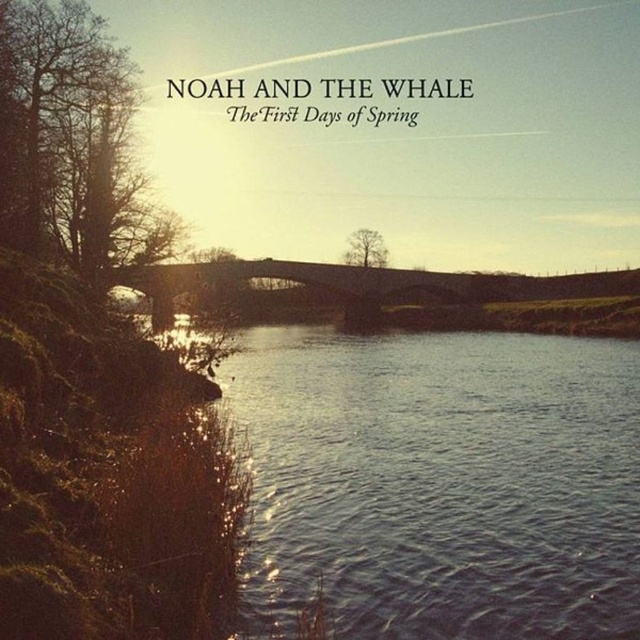
Question: Which object is closer to the camera taking this photo?

Choices:
 (A) bare wood tree at left
 (B) bare wood tree at center

Answer: (A)

Question: Estimate the real-world distances between objects in this image. Which object is farther from the bare wood tree at center?

Choices:
 (A) bare wood tree at left
 (B) blue water at center

Answer: (B)

Question: Does blue water at center have a greater width compared to bare wood tree at left?

Choices:
 (A) no
 (B) yes

Answer: (B)

Question: Is bare wood tree at left wider than bare wood tree at center?

Choices:
 (A) yes
 (B) no

Answer: (B)

Question: Among these points, which one is farthest from the camera?

Choices:
 (A) (88, 189)
 (B) (348, 240)

Answer: (B)

Question: Is blue water at center above bare wood tree at center?

Choices:
 (A) no
 (B) yes

Answer: (A)